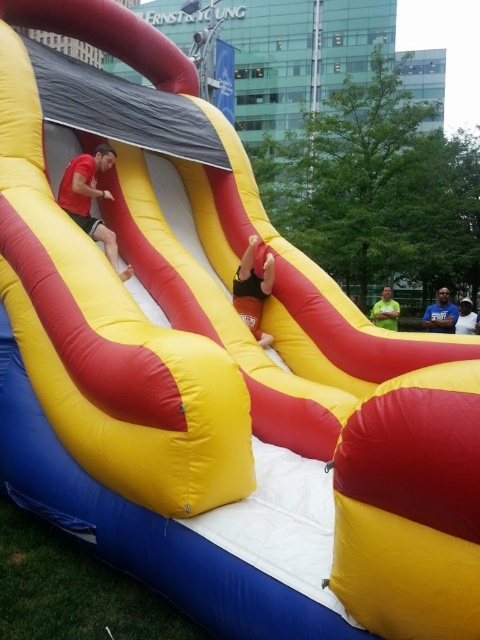
Question: Among these objects, which one is farthest from the camera?

Choices:
 (A) dark blue shirt at center
 (B) white cotton shirt at center
 (C) smooth pink foot at center

Answer: (B)

Question: Can you confirm if smooth pink foot at center is positioned above white cotton shirt at center?

Choices:
 (A) yes
 (B) no

Answer: (A)

Question: Which point appears closest to the camera in this image?

Choices:
 (A) (478, 326)
 (B) (444, 324)
 (C) (92, 180)

Answer: (C)

Question: Which object appears closest to the camera in this image?

Choices:
 (A) white cotton shirt at center
 (B) green matte shirt at lower right

Answer: (A)

Question: Does dark blue shirt at center appear on the right side of green matte shirt at lower right?

Choices:
 (A) no
 (B) yes

Answer: (B)

Question: Is green matte shirt at lower right below white cotton shirt at center?

Choices:
 (A) yes
 (B) no

Answer: (B)